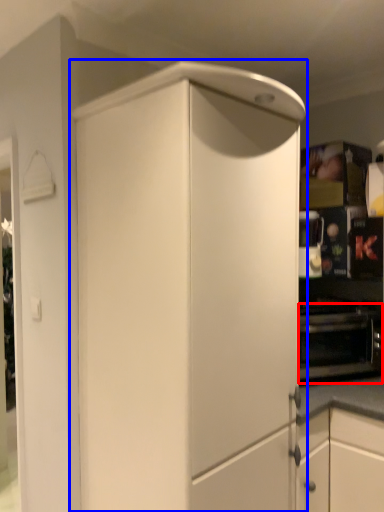
Question: Among these objects, which one is nearest to the camera, oven (highlighted by a red box) or cabinetry (highlighted by a blue box)?

Choices:
 (A) oven
 (B) cabinetry

Answer: (B)